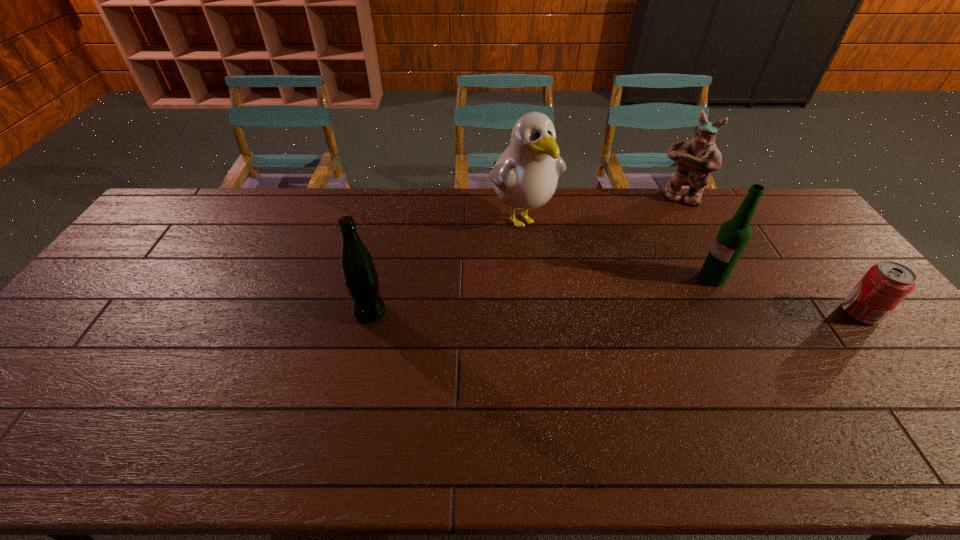
This screenshot has height=540, width=960. Identify the location of vacant area that lies between the tallest object and the leftmost object. (446, 265).

Locate an element on the screen. vacant point located between the rightmost object and the figurine is located at coordinates (770, 255).

Where is `free spot between the figurine and the soda can`? This screenshot has width=960, height=540. free spot between the figurine and the soda can is located at coordinates (770, 255).

The image size is (960, 540). Find the location of `empty space between the figurine and the tallest object`. empty space between the figurine and the tallest object is located at coordinates (x=600, y=208).

Image resolution: width=960 pixels, height=540 pixels. Find the location of `vacant space that's between the nearer beer bottle and the figurine`. vacant space that's between the nearer beer bottle and the figurine is located at coordinates (524, 255).

Where is `free space between the right beer bottle and the left beer bottle`? Image resolution: width=960 pixels, height=540 pixels. free space between the right beer bottle and the left beer bottle is located at coordinates (541, 295).

Where is `free space between the nearer beer bottle and the shortest object`? free space between the nearer beer bottle and the shortest object is located at coordinates (615, 313).

You are a GUI agent. You are given a task and a screenshot of the screen. Output one action in this format:
    pyautogui.click(x=<x>, y=<y>)
    Task: Click on the vacant area that lies between the farther beer bottle and the shortest object
    Image resolution: width=960 pixels, height=540 pixels.
    Given the screenshot: What is the action you would take?
    pyautogui.click(x=786, y=295)

Point out which object is positioned as the fourth nearest to the tallest object. Please provide its 2D coordinates. Your answer should be formatted as a tuple, i.e. [(x, y)], where the tuple contains the x and y coordinates of a point satisfying the conditions above.

[(886, 284)]

Where is `object that is the second closest to the soda can`? The image size is (960, 540). object that is the second closest to the soda can is located at coordinates (696, 159).